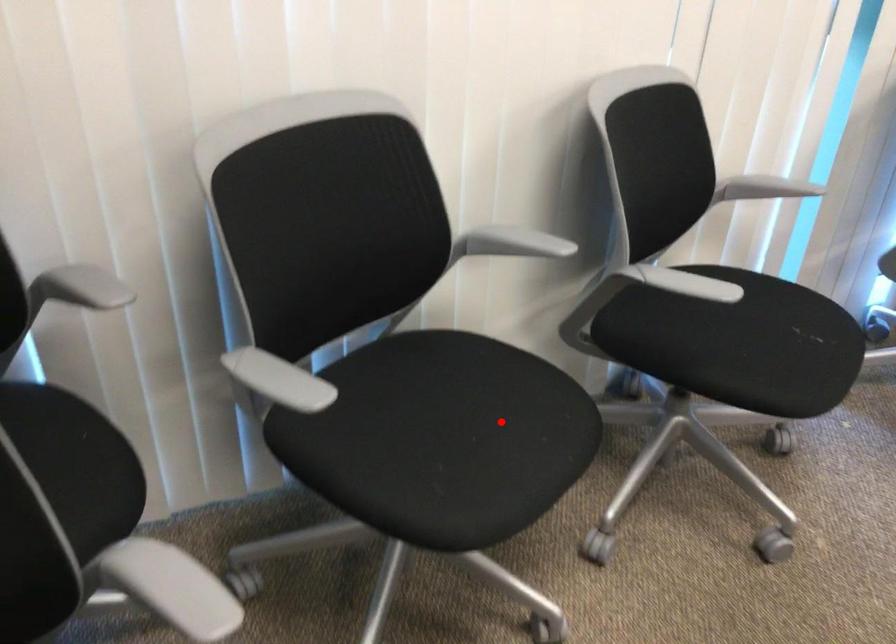
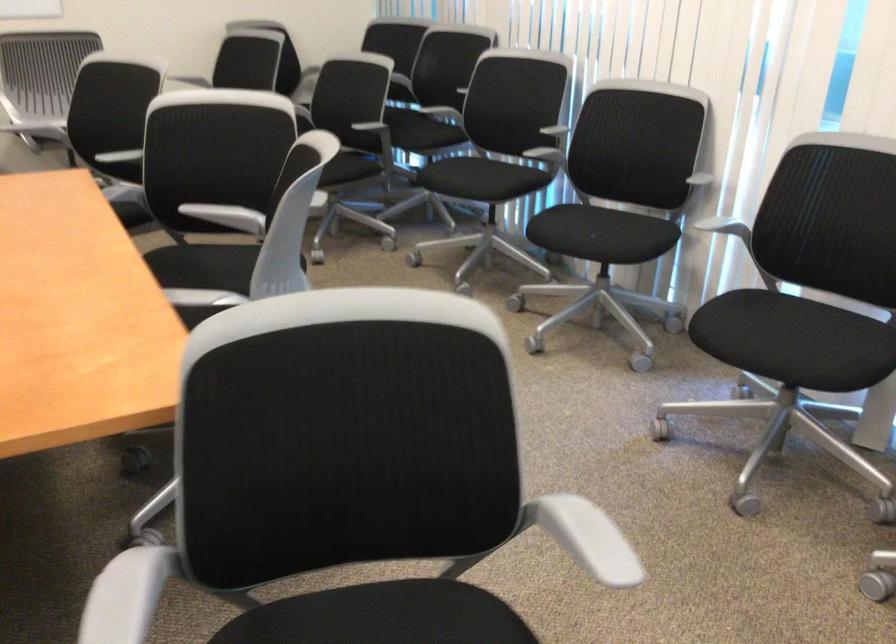
Find the pixel in the second image that matches the highlighted location in the first image.

(480, 178)